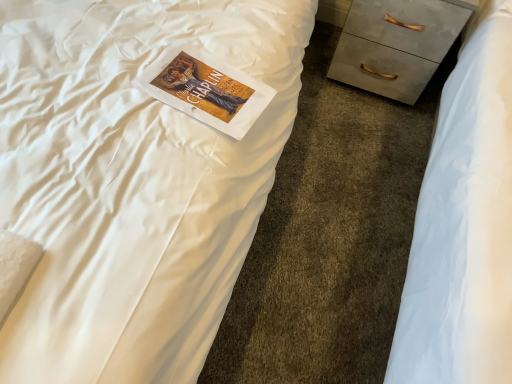
Question: Considering the positions of point (460, 6) and point (178, 54), is point (460, 6) closer or farther from the camera than point (178, 54)?

Choices:
 (A) farther
 (B) closer

Answer: (A)

Question: Is matte gray chest of drawers at right inside the boundaries of matte white paperback book at center, or outside?

Choices:
 (A) outside
 (B) inside

Answer: (A)

Question: From the image's perspective, is matte gray chest of drawers at right positioned above or below matte white paperback book at center?

Choices:
 (A) below
 (B) above

Answer: (B)

Question: Is point (211, 82) positioned closer to the camera than point (359, 28)?

Choices:
 (A) farther
 (B) closer

Answer: (B)

Question: From a real-world perspective, is matte white paperback book at center above or below matte gray chest of drawers at right?

Choices:
 (A) below
 (B) above

Answer: (B)

Question: In terms of width, does matte white paperback book at center look wider or thinner when compared to matte gray chest of drawers at right?

Choices:
 (A) wide
 (B) thin

Answer: (B)

Question: Based on their sizes in the image, would you say matte white paperback book at center is bigger or smaller than matte gray chest of drawers at right?

Choices:
 (A) big
 (B) small

Answer: (B)